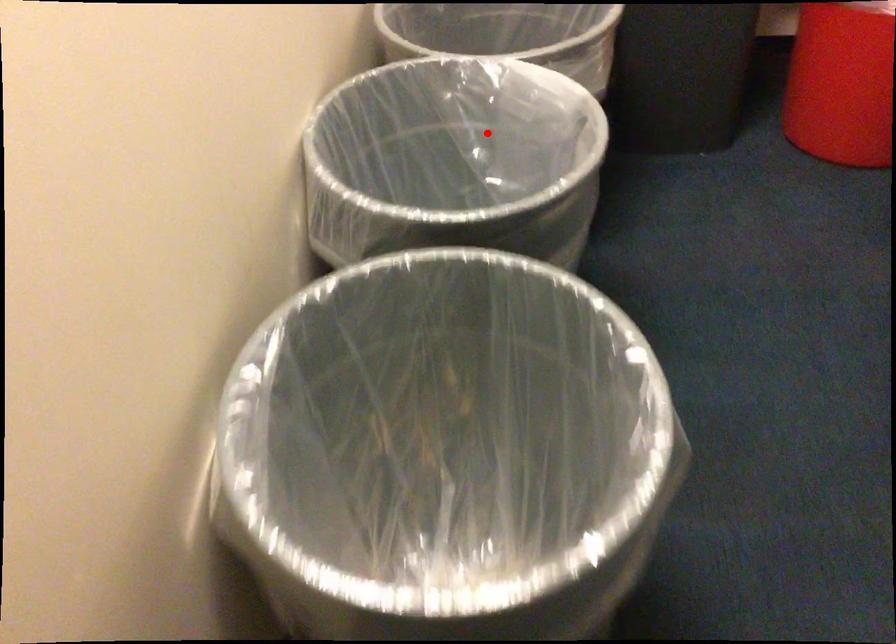
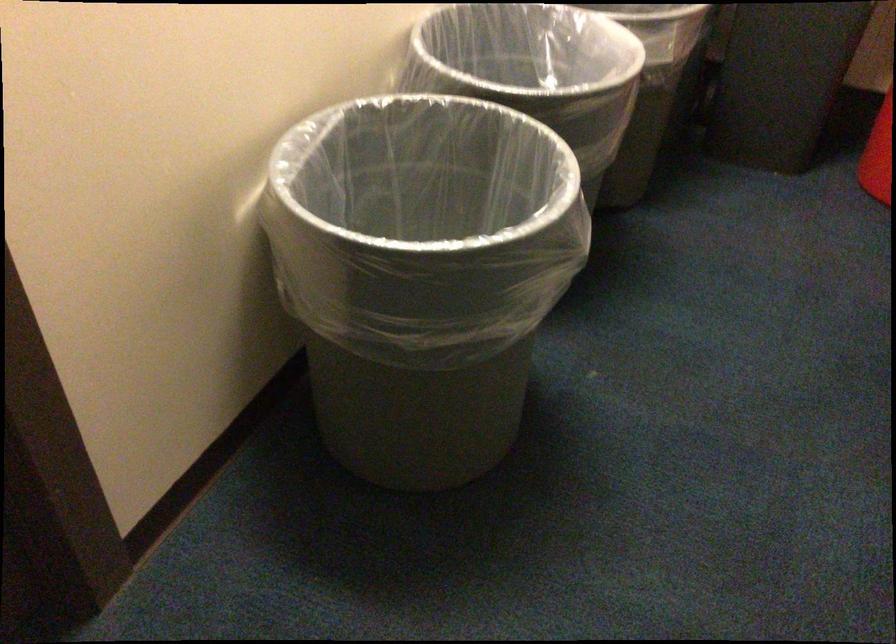
Question: A red point is marked in image1. In image2, is the corresponding 3D point closer to the camera or farther? Reply with the corresponding letter.

Choices:
 (A) The corresponding 3D point is closer.
 (B) The corresponding 3D point is farther.

Answer: (B)